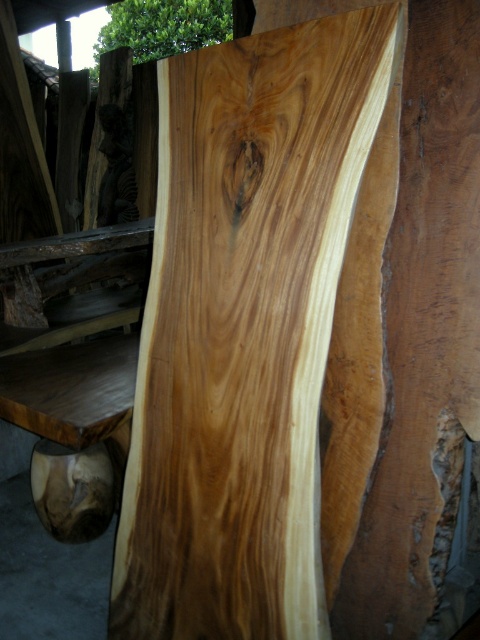
Can you confirm if natural wood plank at center is thinner than green leafy tree at upper center?

Indeed, natural wood plank at center has a lesser width compared to green leafy tree at upper center.

Can you confirm if natural wood plank at center is shorter than green leafy tree at upper center?

No, natural wood plank at center is not shorter than green leafy tree at upper center.

The width and height of the screenshot is (480, 640). What are the coordinates of `natural wood plank at center` in the screenshot? It's located at (259, 332).